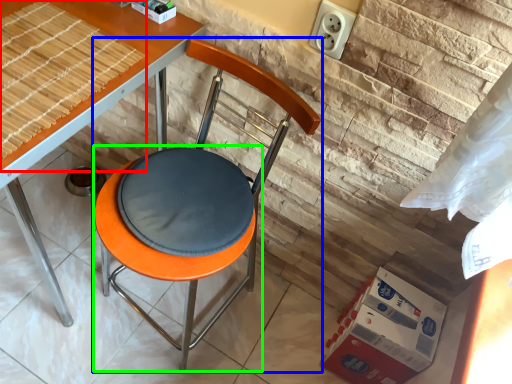
Question: Based on their relative distances, which object is nearer to mat (highlighted by a red box)? Choose from chair (highlighted by a blue box) and bar stool (highlighted by a green box).

Choices:
 (A) chair
 (B) bar stool

Answer: (A)